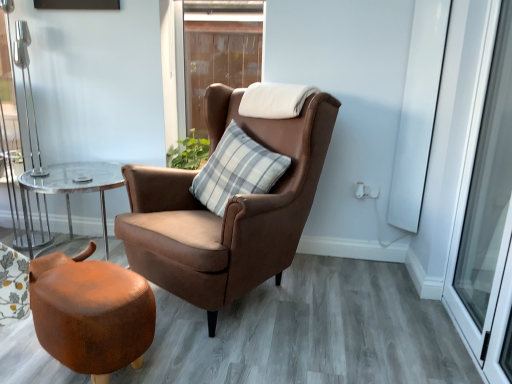
Question: Can you confirm if transparent glass screen door at right, which is the 2th screen door from back to front, is positioned to the left of brown wooden window at upper center?

Choices:
 (A) no
 (B) yes

Answer: (A)

Question: Can you confirm if transparent glass screen door at right, which is the 2th screen door from back to front, is taller than brown wooden window at upper center?

Choices:
 (A) no
 (B) yes

Answer: (B)

Question: Is transparent glass screen door at right, which is the 2th screen door from back to front, not within brown wooden window at upper center?

Choices:
 (A) yes
 (B) no

Answer: (A)

Question: Is transparent glass screen door at right, which is the 2th screen door from back to front, facing towards brown wooden window at upper center?

Choices:
 (A) yes
 (B) no

Answer: (B)

Question: From a real-world perspective, is transparent glass screen door at right, which is the 2th screen door from back to front, on brown wooden window at upper center?

Choices:
 (A) no
 (B) yes

Answer: (A)

Question: Is transparent glass screen door at right, which is the 2th screen door from back to front, facing away from brown wooden window at upper center?

Choices:
 (A) no
 (B) yes

Answer: (A)

Question: Does clear glass table at left have a greater height compared to white glossy screen door at upper right, the second screen door in the front-to-back sequence?

Choices:
 (A) yes
 (B) no

Answer: (B)

Question: Is white glossy screen door at upper right, the second screen door in the front-to-back sequence, located within clear glass table at left?

Choices:
 (A) no
 (B) yes

Answer: (A)

Question: Considering the relative positions of clear glass table at left and white glossy screen door at upper right, the second screen door in the front-to-back sequence, in the image provided, is clear glass table at left in front of white glossy screen door at upper right, the second screen door in the front-to-back sequence,?

Choices:
 (A) no
 (B) yes

Answer: (A)

Question: Is clear glass table at left far away from white glossy screen door at upper right, the second screen door in the front-to-back sequence?

Choices:
 (A) no
 (B) yes

Answer: (B)

Question: From the image's perspective, would you say clear glass table at left is positioned over white glossy screen door at upper right, the first screen door in the back-to-front sequence?

Choices:
 (A) no
 (B) yes

Answer: (A)

Question: Is clear glass table at left bigger than white glossy screen door at upper right, the second screen door in the front-to-back sequence?

Choices:
 (A) no
 (B) yes

Answer: (B)

Question: Does brown wooden window at upper center lie behind gray striped cushion at center?

Choices:
 (A) no
 (B) yes

Answer: (B)